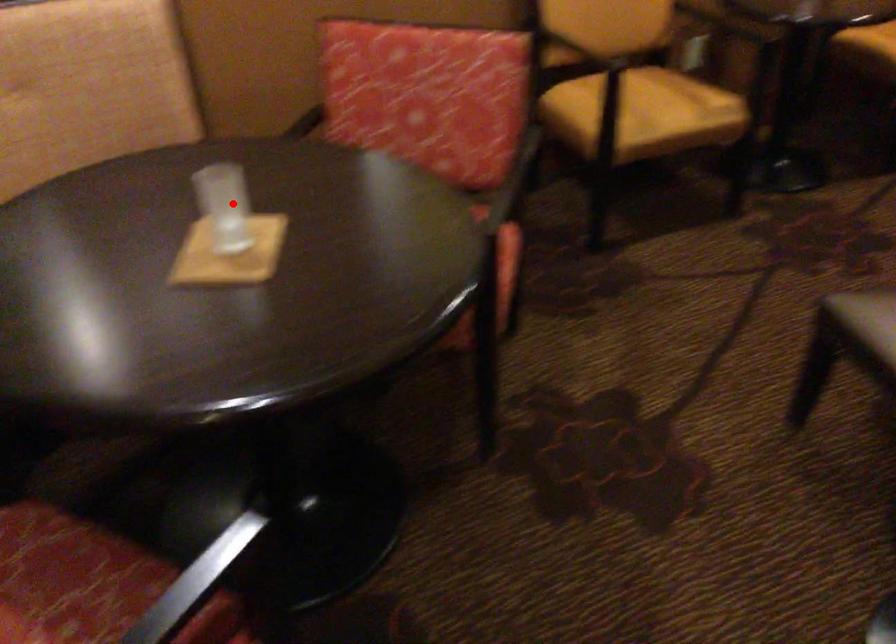
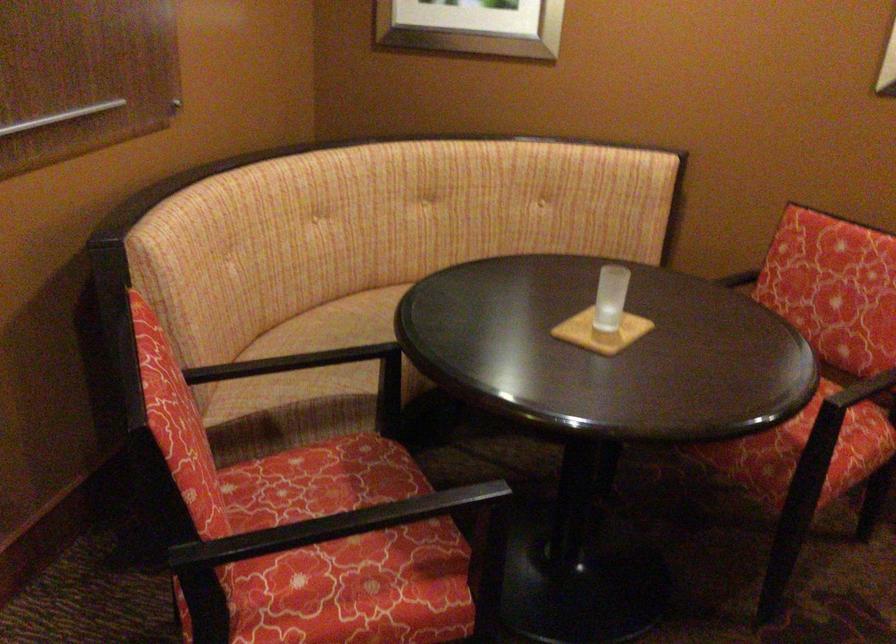
Question: I am providing you with two images of the same scene from different viewpoints. A red point is marked on the first image. Can you still see the location of the red point in image 2?

Choices:
 (A) Yes
 (B) No

Answer: (A)